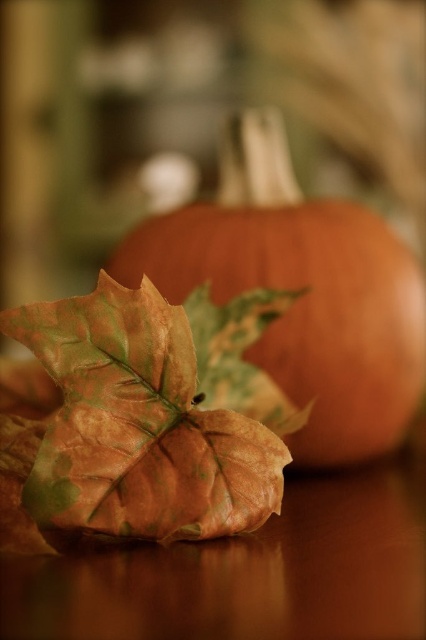
You are planning to place the leathery brown leaf at lower left and the matte orange pumpkin at center on a shelf. If the shelf can only hold items up to the width of the pumpkin, will the leaf fit on the same shelf?

The leathery brown leaf at lower left has a width less than the matte orange pumpkin at center, so it will fit on the shelf since its width is smaller than the pumpkin.

Consider the image. You are standing in an autumn garden and see the leathery brown leaf at lower left and the matte orange pumpkin at center. Which object is positioned to the left of the other?

The leathery brown leaf at lower left is to the left of the matte orange pumpkin at center.

You are setting up a fall display and need to arrange the leathery brown leaf at lower left and the matte orange pumpkin at center. Based on their sizes, which object should be placed lower to ensure stability?

The leathery brown leaf at lower left is not as tall as the matte orange pumpkin at center, so placing the shorter leathery brown leaf at lower left at the bottom and the taller matte orange pumpkin at center on top would provide better stability.